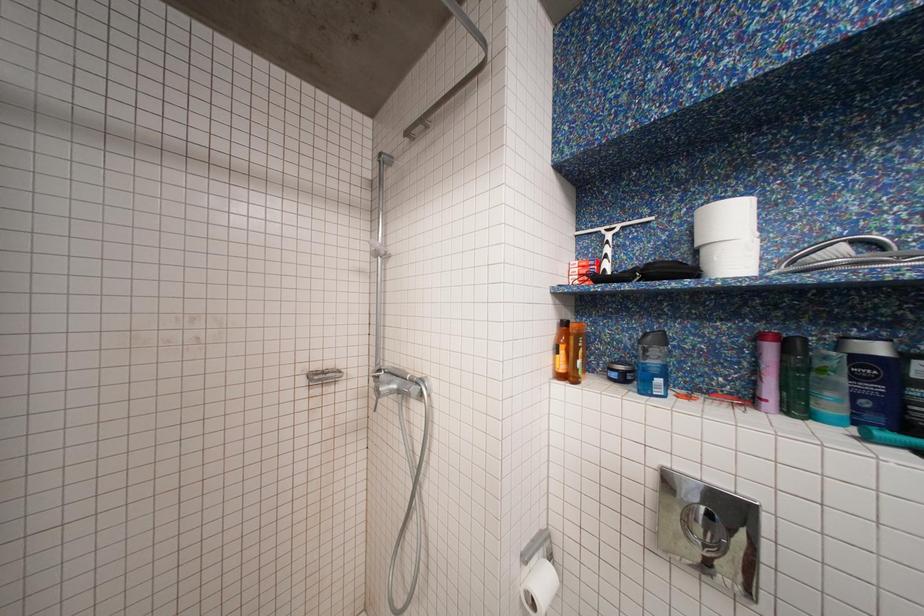
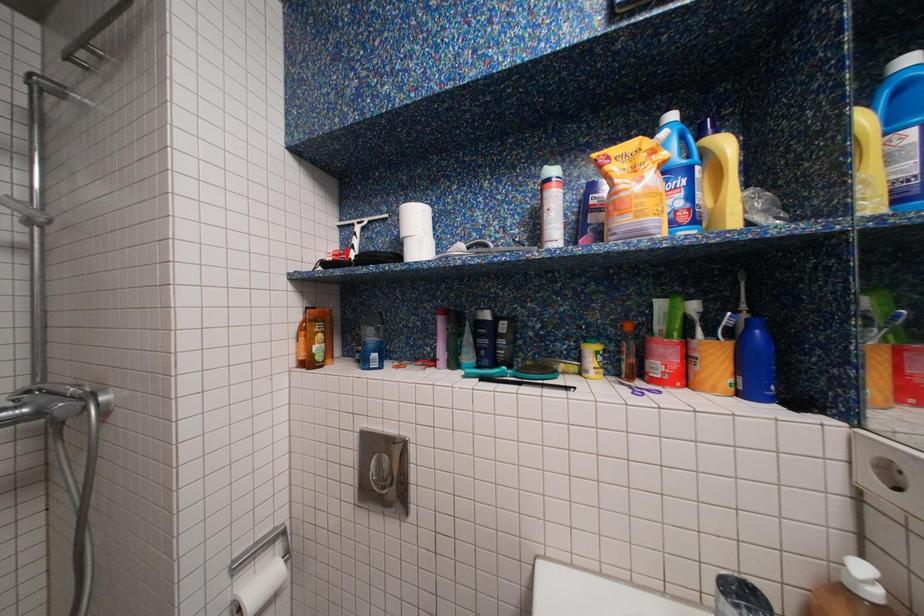
Question: Which direction would the cameraman need to move to produce the second image? Reply with the corresponding letter.

Choices:
 (A) Left
 (B) Right
 (C) Forward
 (D) Backward

Answer: (B)